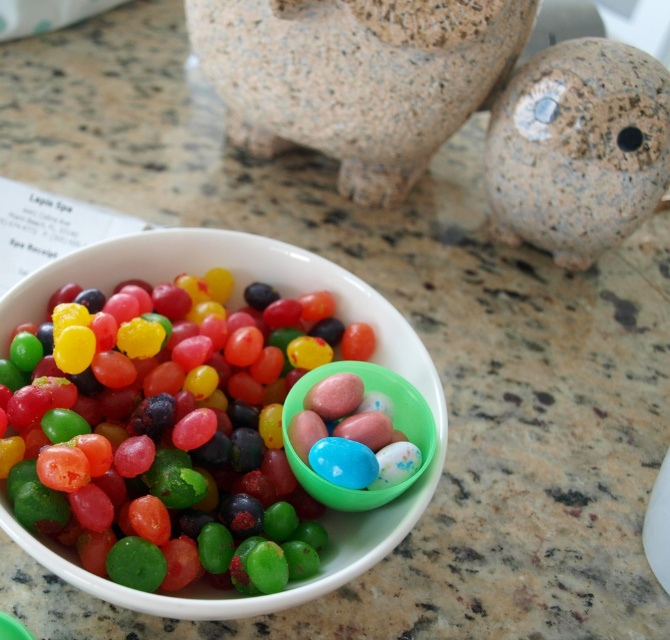
Question: Is granite piggy bank at upper center thinner than speckled stone ball at upper right?

Choices:
 (A) no
 (B) yes

Answer: (A)

Question: Estimate the real-world distances between objects in this image. Which object is closer to the translucent plastic eggs at center?

Choices:
 (A) speckled stone ball at upper right
 (B) granite piggy bank at upper center

Answer: (B)

Question: Is glossy jelly beans at center above granite piggy bank at upper center?

Choices:
 (A) no
 (B) yes

Answer: (A)

Question: Is granite piggy bank at upper center positioned in front of speckled stone ball at upper right?

Choices:
 (A) no
 (B) yes

Answer: (B)

Question: Which of these objects is positioned closest to the granite piggy bank at upper center?

Choices:
 (A) translucent plastic eggs at center
 (B) glossy jelly beans at center

Answer: (B)

Question: Which is nearer to the glossy jelly beans at center?

Choices:
 (A) speckled stone ball at upper right
 (B) translucent plastic eggs at center

Answer: (B)